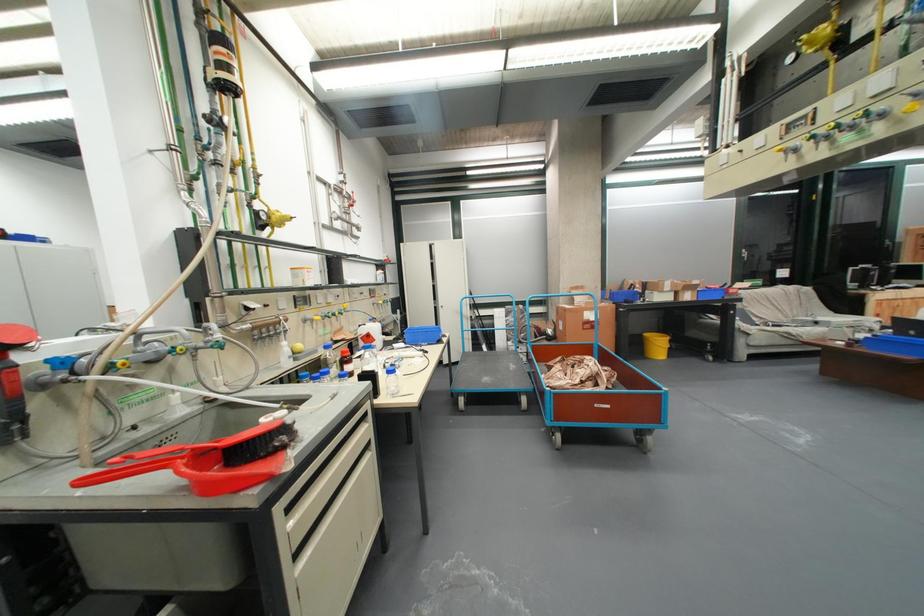
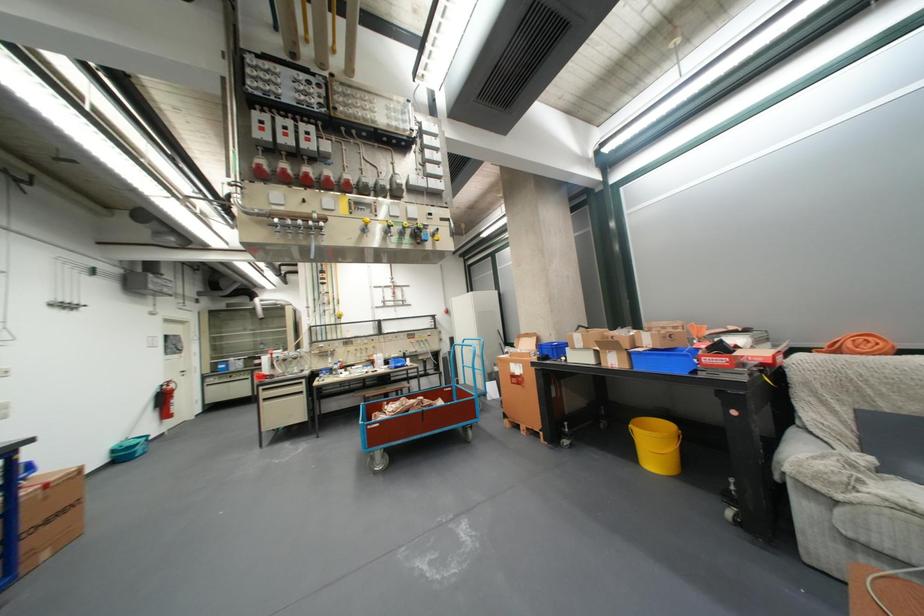
In the second image, find the point that corresponds to (x=707, y=300) in the first image.

(638, 368)